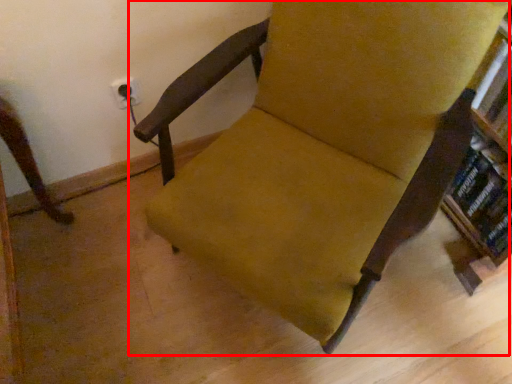
Question: From the image's perspective, where is chair (annotated by the red box) located relative to book?

Choices:
 (A) below
 (B) above

Answer: (B)